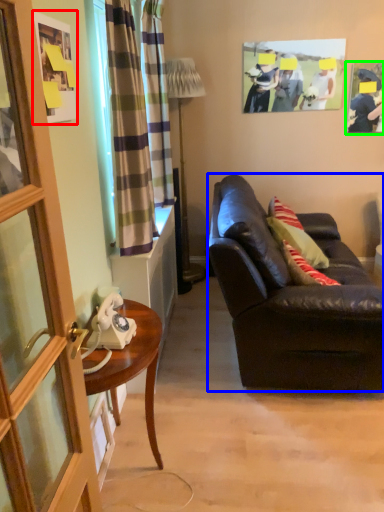
Question: Which object is positioned closest to picture frame (highlighted by a red box)? Select from studio couch (highlighted by a blue box) and picture frame (highlighted by a green box).

Choices:
 (A) studio couch
 (B) picture frame

Answer: (A)